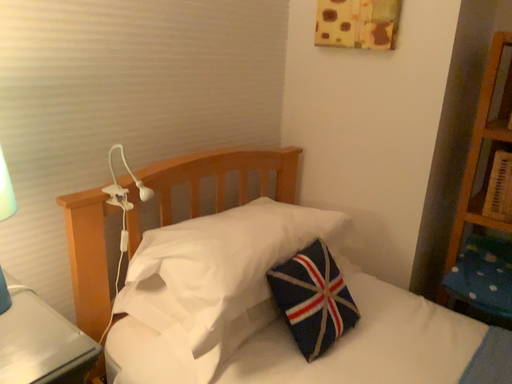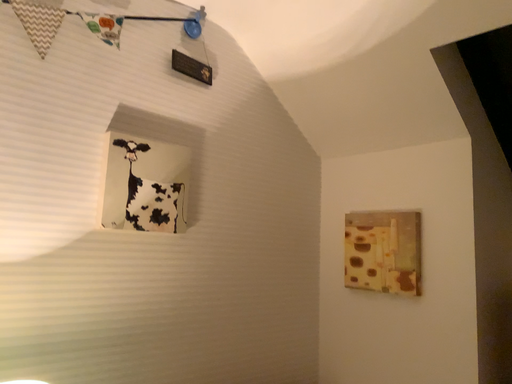
Question: Which way did the camera rotate in the video?

Choices:
 (A) rotated upward
 (B) rotated downward

Answer: (A)